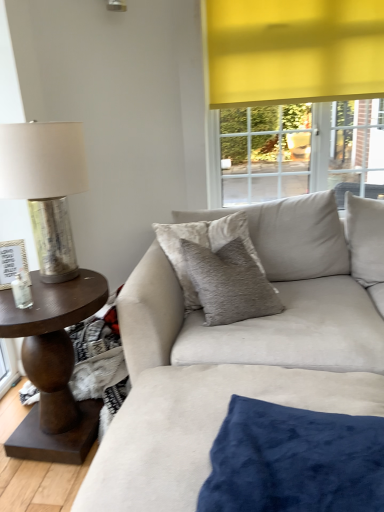
Question: Considering the positions of velvet beige pillow at center, which is the 2th pillow in bottom-to-top order, and velvet blue pillow at lower center, which appears as the first pillow when ordered from the bottom, in the image, is velvet beige pillow at center, which is the 2th pillow in bottom-to-top order, wider or thinner than velvet blue pillow at lower center, which appears as the first pillow when ordered from the bottom,?

Choices:
 (A) wide
 (B) thin

Answer: (B)

Question: Considering the relative positions of velvet beige pillow at center, the 1th pillow from the top, and velvet blue pillow at lower center, which appears as the first pillow when ordered from the bottom, in the image provided, is velvet beige pillow at center, the 1th pillow from the top, to the left or to the right of velvet blue pillow at lower center, which appears as the first pillow when ordered from the bottom,?

Choices:
 (A) left
 (B) right

Answer: (A)

Question: Estimate the real-world distances between objects in this image. Which object is farther from the velvet blue pillow at lower center, the second pillow in the back-to-front sequence?

Choices:
 (A) metallic silver table lamp at left
 (B) suede couch at center
 (C) velvet beige pillow at center, positioned as the 2th pillow in front-to-back order
 (D) dark brown wood side table at left

Answer: (A)

Question: Which object is the closest to the suede couch at center?

Choices:
 (A) dark brown wood side table at left
 (B) metallic silver table lamp at left
 (C) velvet blue pillow at lower center, the second pillow when ordered from top to bottom
 (D) velvet beige pillow at center, acting as the 1th pillow starting from the back

Answer: (D)